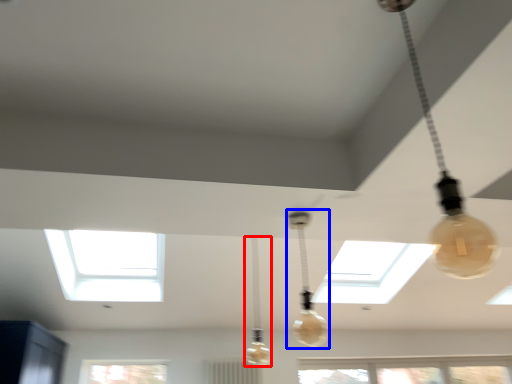
Question: Which object appears closest to the camera in this image, lamp (highlighted by a red box) or lamp (highlighted by a blue box)?

Choices:
 (A) lamp
 (B) lamp

Answer: (B)